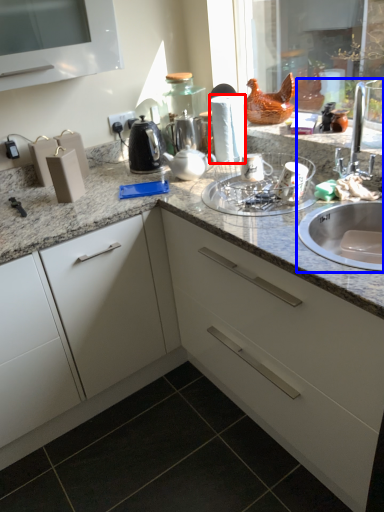
Question: Which object appears closest to the camera in this image, paper towel (highlighted by a red box) or sink (highlighted by a blue box)?

Choices:
 (A) paper towel
 (B) sink

Answer: (B)